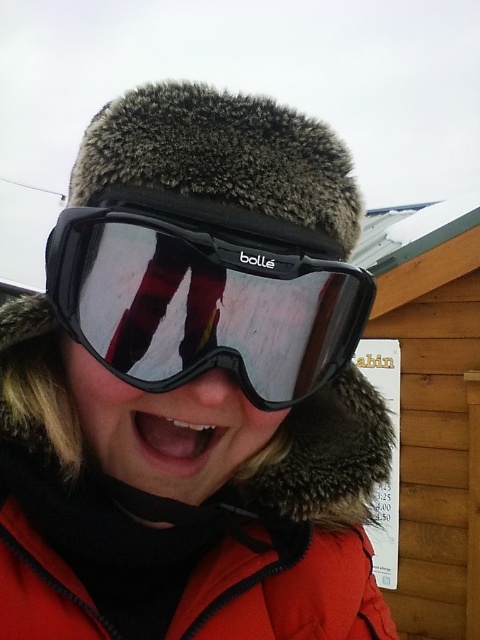
You are a photographer trying to capture the orange fleece jacket at center and the black matte ski goggles at center in a single frame. Given their sizes, which object should you focus on to ensure both are clearly visible in your photo?

The orange fleece jacket at center is larger in size than the black matte ski goggles at center, so focusing on the orange fleece jacket at center would ensure both objects are clearly visible in the photo.

You are standing in front of the wooden cabin with a slanted roof and see a point at coordinates (179,369). If you want to touch that point with a ruler that is 20 inches long, will the ruler be long enough to reach it?

The point at coordinates (179,369) is 21.72 inches from the viewer. Since the ruler is only 20 inches long, it will not be long enough to reach the point.

You are standing at a wooden cabin and see two points marked in the image. The first point is at coordinates point (103, 330) and the second is at point (146, 412). Which point is closer to you?

Point (103, 330) is in front of point (146, 412), so it is closer to you.